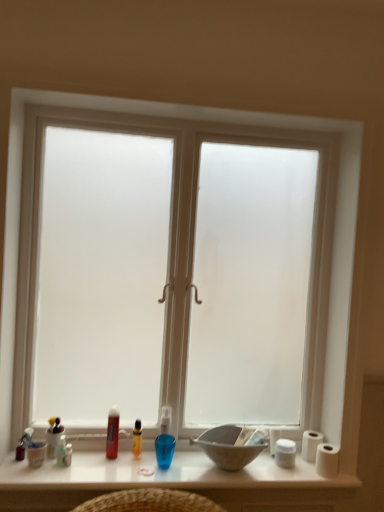
Measure the distance between point (340, 494) and camera.

The depth of point (340, 494) is 1.77 meters.

Image resolution: width=384 pixels, height=512 pixels. What do you see at coordinates (327, 460) in the screenshot?
I see `white matte toilet paper at right, the first toilet paper positioned from the front` at bounding box center [327, 460].

In the scene shown: Measure the distance between translucent plastic tube at lower center, which is counted as the second toiletry, starting from the right, and camera.

translucent plastic tube at lower center, which is counted as the second toiletry, starting from the right, is 1.81 meters away from camera.

Image resolution: width=384 pixels, height=512 pixels. What do you see at coordinates (310, 444) in the screenshot?
I see `white matte toilet paper at right, arranged as the second toilet paper when viewed from the front` at bounding box center [310, 444].

Locate an element on the screen. This screenshot has height=512, width=384. matte gray bowl at center is located at coordinates (227, 447).

From the picture: Who is taller, translucent plastic container at lower left, positioned as the 1th toiletry in left-to-right order, or white matte toilet paper at right, arranged as the second toilet paper when viewed from the front?

With more height is translucent plastic container at lower left, positioned as the 1th toiletry in left-to-right order.

Considering the sizes of objects translucent plastic container at lower left, which is counted as the fifth toiletry, starting from the right, and white matte toilet paper at right, which is the 1th toilet paper from back to front, in the image provided, who is smaller, translucent plastic container at lower left, which is counted as the fifth toiletry, starting from the right, or white matte toilet paper at right, which is the 1th toilet paper from back to front,?

translucent plastic container at lower left, which is counted as the fifth toiletry, starting from the right.

I want to click on the 2nd toilet paper positioned below the translucent plastic container at lower left, which is counted as the fifth toiletry, starting from the right (from a real-world perspective), so click(310, 444).

Measure the distance from translucent plastic container at lower left, positioned as the 1th toiletry in left-to-right order, to white matte toilet paper at right, which is the 1th toilet paper from back to front.

A distance of 1.11 meters exists between translucent plastic container at lower left, positioned as the 1th toiletry in left-to-right order, and white matte toilet paper at right, which is the 1th toilet paper from back to front.

Is translucent plastic bottle at center, arranged as the 1th toiletry when viewed from the right, turned away from white matte toilet paper at right, arranged as the second toilet paper when viewed from the front?

That's not correct — translucent plastic bottle at center, arranged as the 1th toiletry when viewed from the right, is not looking away from white matte toilet paper at right, arranged as the second toilet paper when viewed from the front.

Looking at this image, is translucent plastic bottle at center, marked as the fifth toiletry in a left-to-right arrangement, next to white matte toilet paper at right, arranged as the second toilet paper when viewed from the front?

translucent plastic bottle at center, marked as the fifth toiletry in a left-to-right arrangement, is not next to white matte toilet paper at right, arranged as the second toilet paper when viewed from the front, and they're not touching.

Is translucent plastic bottle at center, arranged as the 1th toiletry when viewed from the right, outside of white matte toilet paper at right, which is the 1th toilet paper from back to front?

That's correct, translucent plastic bottle at center, arranged as the 1th toiletry when viewed from the right, is outside of white matte toilet paper at right, which is the 1th toilet paper from back to front.

Is the depth of translucent plastic bottle at center, arranged as the 1th toiletry when viewed from the right, less than that of white matte toilet paper at right, which is the 1th toilet paper from back to front?

That is True.

What's the angular difference between translucent plastic bottle at center, arranged as the 1th toiletry when viewed from the right, and frosted glass window at center's facing directions?

The angle between the facing direction of translucent plastic bottle at center, arranged as the 1th toiletry when viewed from the right, and the facing direction of frosted glass window at center is 0.00257 degrees.

Based on the photo, considering the relative sizes of translucent plastic bottle at center, arranged as the 1th toiletry when viewed from the right, and frosted glass window at center in the image provided, is translucent plastic bottle at center, arranged as the 1th toiletry when viewed from the right, smaller than frosted glass window at center?

Yes, translucent plastic bottle at center, arranged as the 1th toiletry when viewed from the right, is smaller than frosted glass window at center.

Is translucent plastic bottle at center, marked as the fifth toiletry in a left-to-right arrangement, oriented towards frosted glass window at center?

Yes, translucent plastic bottle at center, marked as the fifth toiletry in a left-to-right arrangement, is oriented towards frosted glass window at center.

From a real-world perspective, who is located lower, translucent plastic bottle at center, arranged as the 1th toiletry when viewed from the right, or frosted glass window at center?

translucent plastic bottle at center, arranged as the 1th toiletry when viewed from the right, is physically lower.

Is translucent plastic bottle at center, marked as the fifth toiletry in a left-to-right arrangement, placed right next to translucent plastic tube at lower center, the fourth toiletry viewed from the left?

Yes, translucent plastic bottle at center, marked as the fifth toiletry in a left-to-right arrangement, and translucent plastic tube at lower center, the fourth toiletry viewed from the left, clearly make contact.

Is translucent plastic bottle at center, arranged as the 1th toiletry when viewed from the right, completely or partially outside of translucent plastic tube at lower center, which is counted as the second toiletry, starting from the right?

translucent plastic bottle at center, arranged as the 1th toiletry when viewed from the right, lies outside translucent plastic tube at lower center, which is counted as the second toiletry, starting from the right,'s area.

From the image's perspective, is translucent plastic bottle at center, marked as the fifth toiletry in a left-to-right arrangement, located above translucent plastic tube at lower center, the fourth toiletry viewed from the left?

No, from the image's perspective, translucent plastic bottle at center, marked as the fifth toiletry in a left-to-right arrangement, is not on top of translucent plastic tube at lower center, the fourth toiletry viewed from the left.

Is translucent plastic bottle at center, marked as the fifth toiletry in a left-to-right arrangement, wider or thinner than translucent plastic tube at lower center, the fourth toiletry viewed from the left?

In the image, translucent plastic bottle at center, marked as the fifth toiletry in a left-to-right arrangement, appears to be more narrow than translucent plastic tube at lower center, the fourth toiletry viewed from the left.

Which is in front, translucent plastic container at lower left, positioned as the 1th toiletry in left-to-right order, or matte white cup at lower left, the 4th toiletry viewed from the right?

matte white cup at lower left, the 4th toiletry viewed from the right.

Is there a large distance between translucent plastic container at lower left, positioned as the 1th toiletry in left-to-right order, and matte white cup at lower left, placed as the 2th toiletry when sorted from left to right?

No, there isn't a large distance between translucent plastic container at lower left, positioned as the 1th toiletry in left-to-right order, and matte white cup at lower left, placed as the 2th toiletry when sorted from left to right.

Is translucent plastic container at lower left, positioned as the 1th toiletry in left-to-right order, outside of matte white cup at lower left, the 4th toiletry viewed from the right?

Yes.

Between translucent plastic container at lower left, which is counted as the fifth toiletry, starting from the right, and matte white cup at lower left, the 4th toiletry viewed from the right, which one has less height?

With less height is matte white cup at lower left, the 4th toiletry viewed from the right.

How different are the orientations of frosted glass window at center and white matte toilet paper at right, placed as the second toilet paper when sorted from back to front, in degrees?

The angle between the facing direction of frosted glass window at center and the facing direction of white matte toilet paper at right, placed as the second toilet paper when sorted from back to front, is 0.000482 degrees.

From a real-world perspective, is frosted glass window at center on white matte toilet paper at right, the first toilet paper positioned from the front?

Yes, from a real-world perspective, frosted glass window at center is over white matte toilet paper at right, the first toilet paper positioned from the front

Do you think frosted glass window at center is within white matte toilet paper at right, the first toilet paper positioned from the front, or outside of it?

frosted glass window at center cannot be found inside white matte toilet paper at right, the first toilet paper positioned from the front.

Is frosted glass window at center looking in the opposite direction of white matte toilet paper at right, placed as the second toilet paper when sorted from back to front?

No, frosted glass window at center is not facing away from white matte toilet paper at right, placed as the second toilet paper when sorted from back to front.

Can you confirm if translucent plastic bottle at center, arranged as the 1th toiletry when viewed from the right, is positioned to the left of translucent plastic bottle at lower left, which is counted as the 3th toiletry, starting from the left?

Incorrect, translucent plastic bottle at center, arranged as the 1th toiletry when viewed from the right, is not on the left side of translucent plastic bottle at lower left, which is counted as the 3th toiletry, starting from the left.

Looking at this image, considering the relative sizes of translucent plastic bottle at center, arranged as the 1th toiletry when viewed from the right, and translucent plastic bottle at lower left, which is counted as the 3th toiletry, starting from the left, in the image provided, is translucent plastic bottle at center, arranged as the 1th toiletry when viewed from the right, smaller than translucent plastic bottle at lower left, which is counted as the 3th toiletry, starting from the left,?

Actually, translucent plastic bottle at center, arranged as the 1th toiletry when viewed from the right, might be larger than translucent plastic bottle at lower left, which is counted as the 3th toiletry, starting from the left.

Considering the sizes of translucent plastic bottle at center, arranged as the 1th toiletry when viewed from the right, and translucent plastic bottle at lower left, which is counted as the 3th toiletry, starting from the left, in the image, is translucent plastic bottle at center, arranged as the 1th toiletry when viewed from the right, wider or thinner than translucent plastic bottle at lower left, which is counted as the 3th toiletry, starting from the left,?

Clearly, translucent plastic bottle at center, arranged as the 1th toiletry when viewed from the right, has more width compared to translucent plastic bottle at lower left, which is counted as the 3th toiletry, starting from the left.

From the image's perspective, which is below, translucent plastic bottle at center, marked as the fifth toiletry in a left-to-right arrangement, or translucent plastic bottle at lower left, which appears as the third toiletry when viewed from the right?

From the image's view, translucent plastic bottle at lower left, which appears as the third toiletry when viewed from the right, is below.

Find the location of a particular element. toilet paper that is the 1st one when counting rightward from the translucent plastic container at lower left, positioned as the 1th toiletry in left-to-right order is located at coordinates (310, 444).

I want to click on toiletry that is the 1st object to the left of the white matte toilet paper at right, arranged as the second toilet paper when viewed from the front, starting at the anchor, so click(x=137, y=438).

When comparing their distances from white glossy table at lower center, does matte white cup at lower left, placed as the 2th toiletry when sorted from left to right, or white matte toilet paper at right, placed as the second toilet paper when sorted from back to front, seem further?

white matte toilet paper at right, placed as the second toilet paper when sorted from back to front.

Considering their positions, is translucent plastic bottle at center, arranged as the 1th toiletry when viewed from the right, positioned further to translucent plastic bottle at lower left, which appears as the third toiletry when viewed from the right, than matte gray bowl at center?

Based on the image, matte gray bowl at center appears to be further to translucent plastic bottle at lower left, which appears as the third toiletry when viewed from the right.

Which object lies further to the anchor point translucent plastic bottle at center, marked as the fifth toiletry in a left-to-right arrangement, translucent plastic container at lower left, which is counted as the fifth toiletry, starting from the right, or frosted glass window at center?

The object further to translucent plastic bottle at center, marked as the fifth toiletry in a left-to-right arrangement, is frosted glass window at center.

Looking at the image, which one is located further to frosted glass window at center, matte white cup at lower left, placed as the 2th toiletry when sorted from left to right, or translucent plastic tube at lower center, which is counted as the second toiletry, starting from the right?

Among the two, matte white cup at lower left, placed as the 2th toiletry when sorted from left to right, is located further to frosted glass window at center.

Which object lies further to the anchor point translucent plastic tube at lower center, which is counted as the second toiletry, starting from the right, white glossy table at lower center or white matte toilet paper at right, the first toilet paper positioned from the front?

white matte toilet paper at right, the first toilet paper positioned from the front.

Considering their positions, is translucent plastic tube at lower center, which is counted as the second toiletry, starting from the right, positioned further to translucent plastic bottle at center, marked as the fifth toiletry in a left-to-right arrangement, than white matte toilet paper at right, placed as the second toilet paper when sorted from back to front?

Based on the image, white matte toilet paper at right, placed as the second toilet paper when sorted from back to front, appears to be further to translucent plastic bottle at center, marked as the fifth toiletry in a left-to-right arrangement.

Considering their positions, is translucent plastic bottle at lower left, which is counted as the 3th toiletry, starting from the left, positioned further to translucent plastic container at lower left, which is counted as the fifth toiletry, starting from the right, than white matte toilet paper at right, placed as the second toilet paper when sorted from back to front?

Based on the image, white matte toilet paper at right, placed as the second toilet paper when sorted from back to front, appears to be further to translucent plastic container at lower left, which is counted as the fifth toiletry, starting from the right.

Based on their spatial positions, is white glossy table at lower center or frosted glass window at center further from matte gray bowl at center?

frosted glass window at center is further to matte gray bowl at center.

Where is `window between translucent plastic bottle at lower left, which is counted as the 3th toiletry, starting from the left, and white matte toilet paper at right, placed as the second toilet paper when sorted from back to front`? The image size is (384, 512). window between translucent plastic bottle at lower left, which is counted as the 3th toiletry, starting from the left, and white matte toilet paper at right, placed as the second toilet paper when sorted from back to front is located at coordinates (211, 121).

Where is `table situated between matte white cup at lower left, placed as the 2th toiletry when sorted from left to right, and white matte toilet paper at right, which is the 1th toilet paper from back to front, from left to right`? table situated between matte white cup at lower left, placed as the 2th toiletry when sorted from left to right, and white matte toilet paper at right, which is the 1th toilet paper from back to front, from left to right is located at coordinates [x=172, y=482].

Where is `bowl located between translucent plastic bottle at lower left, which is counted as the 3th toiletry, starting from the left, and white matte toilet paper at right, the first toilet paper positioned from the front, in the left-right direction`? This screenshot has width=384, height=512. bowl located between translucent plastic bottle at lower left, which is counted as the 3th toiletry, starting from the left, and white matte toilet paper at right, the first toilet paper positioned from the front, in the left-right direction is located at coordinates point(227,447).

Where is `toilet paper between translucent plastic bottle at center, marked as the fifth toiletry in a left-to-right arrangement, and white matte toilet paper at right, placed as the second toilet paper when sorted from back to front`? The height and width of the screenshot is (512, 384). toilet paper between translucent plastic bottle at center, marked as the fifth toiletry in a left-to-right arrangement, and white matte toilet paper at right, placed as the second toilet paper when sorted from back to front is located at coordinates (310, 444).